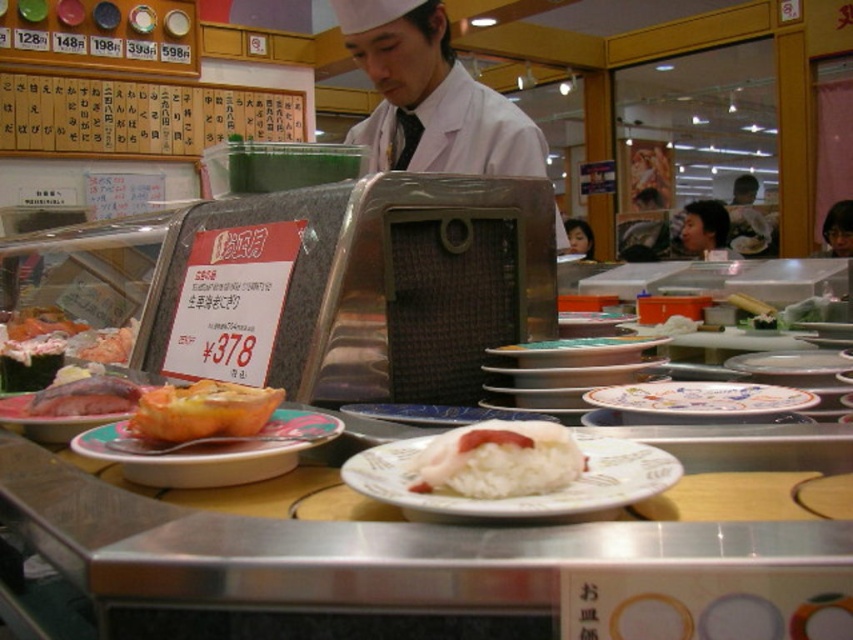
Question: Observing the image, what is the correct spatial positioning of white glossy rice at center in reference to white rice at center?

Choices:
 (A) below
 (B) above

Answer: (A)

Question: Which of the following is the closest to the observer?

Choices:
 (A) (793, 401)
 (B) (792, 362)
 (C) (97, 403)

Answer: (A)

Question: Can you confirm if white rice at center is positioned above porcelain plate at center?

Choices:
 (A) no
 (B) yes

Answer: (A)

Question: Which object appears closest to the camera in this image?

Choices:
 (A) golden crispy pastry at center
 (B) porcelain plate at center
 (C) wooden signboard at upper left
 (D) white glossy plate at center

Answer: (A)

Question: Is the position of white rice at center less distant than that of matte ceramic plate at center?

Choices:
 (A) no
 (B) yes

Answer: (B)

Question: Which object is farther from the camera taking this photo?

Choices:
 (A) white glossy plate at center
 (B) white matte uniform at center
 (C) golden crispy pastry at center
 (D) porcelain plate at center

Answer: (B)